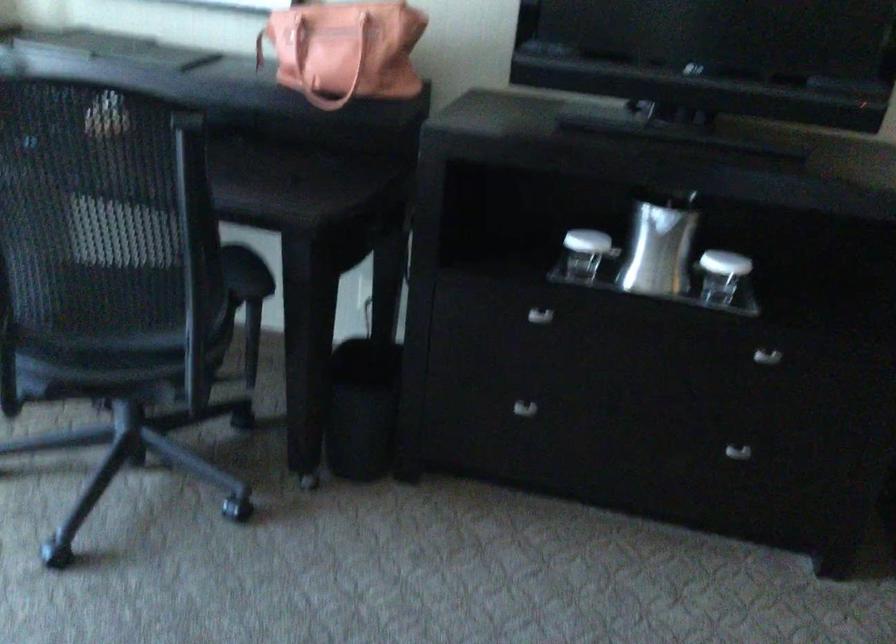
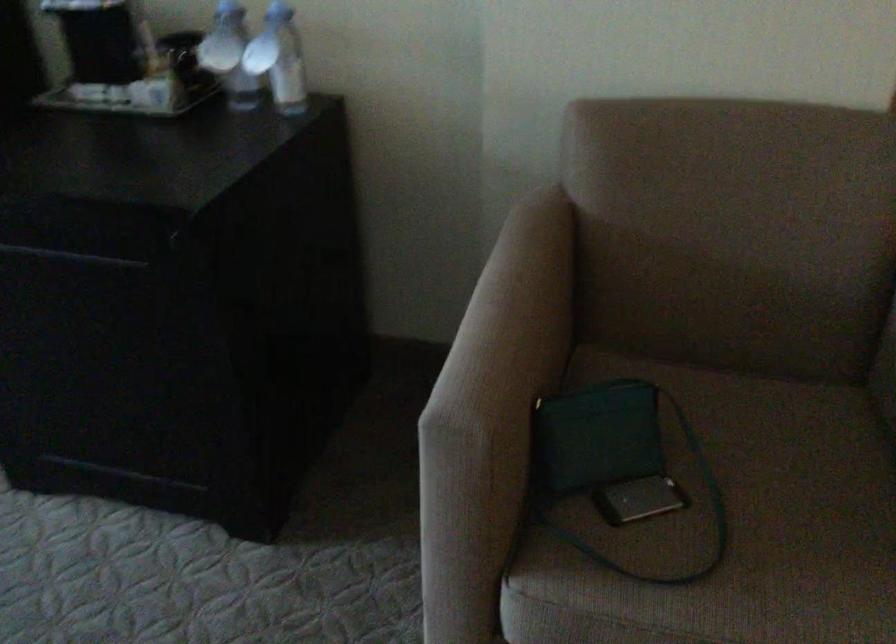
Question: Which direction would the cameraman need to move to produce the second image? Reply with the corresponding letter.

Choices:
 (A) Left
 (B) Right
 (C) Forward
 (D) Backward

Answer: (B)